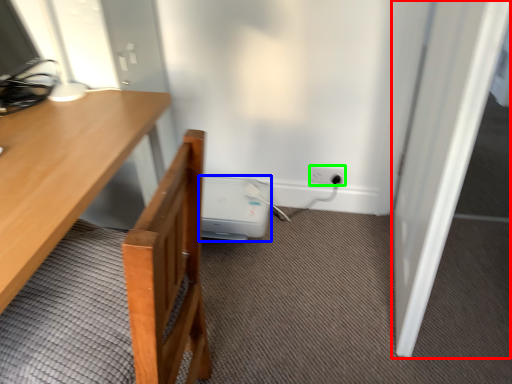
Question: Which object is positioned farthest from door (highlighted by a red box)? Select from water heater (highlighted by a blue box) and electric outlet (highlighted by a green box).

Choices:
 (A) water heater
 (B) electric outlet

Answer: (A)